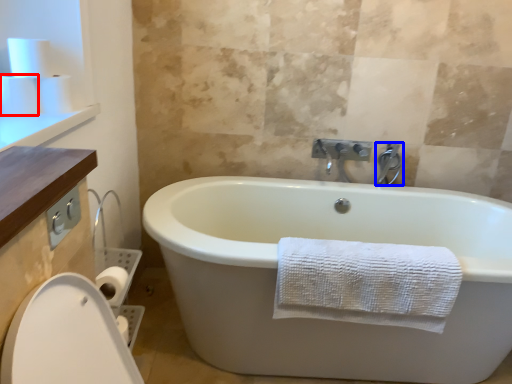
Question: Among these objects, which one is farthest to the camera, toilet paper (highlighted by a red box) or tap (highlighted by a blue box)?

Choices:
 (A) toilet paper
 (B) tap

Answer: (B)